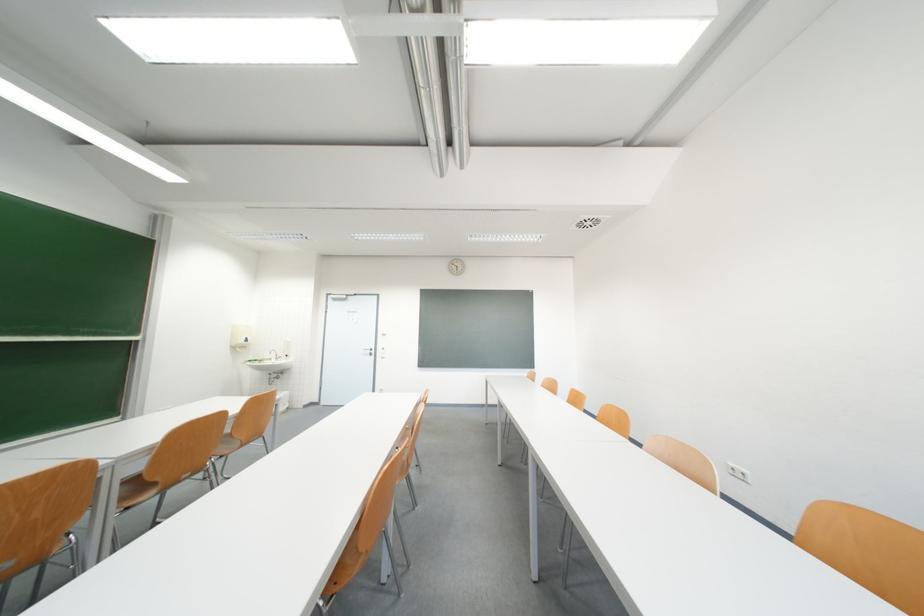
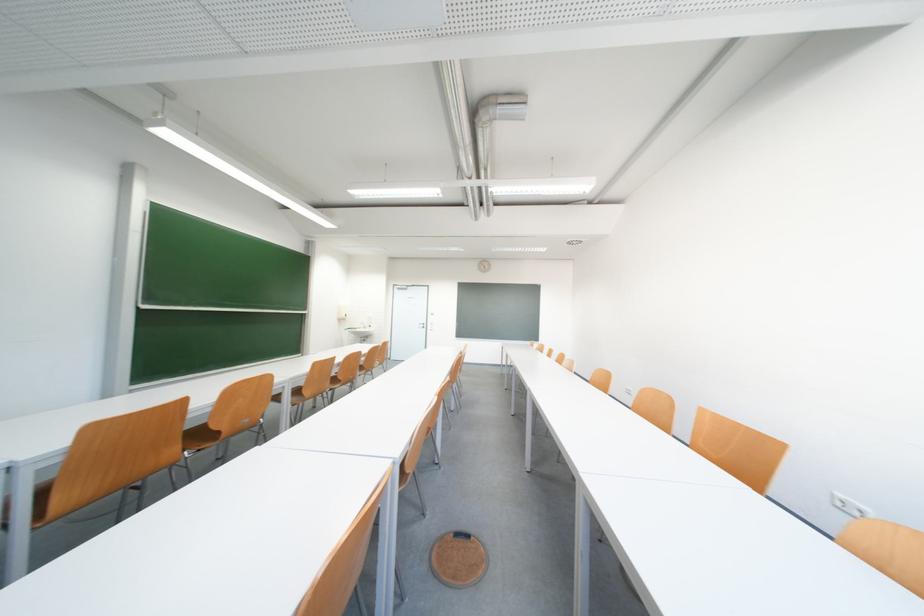
Question: Which direction would the cameraman need to move to produce the second image? Reply with the corresponding letter.

Choices:
 (A) Left
 (B) Right
 (C) Forward
 (D) Backward

Answer: (D)